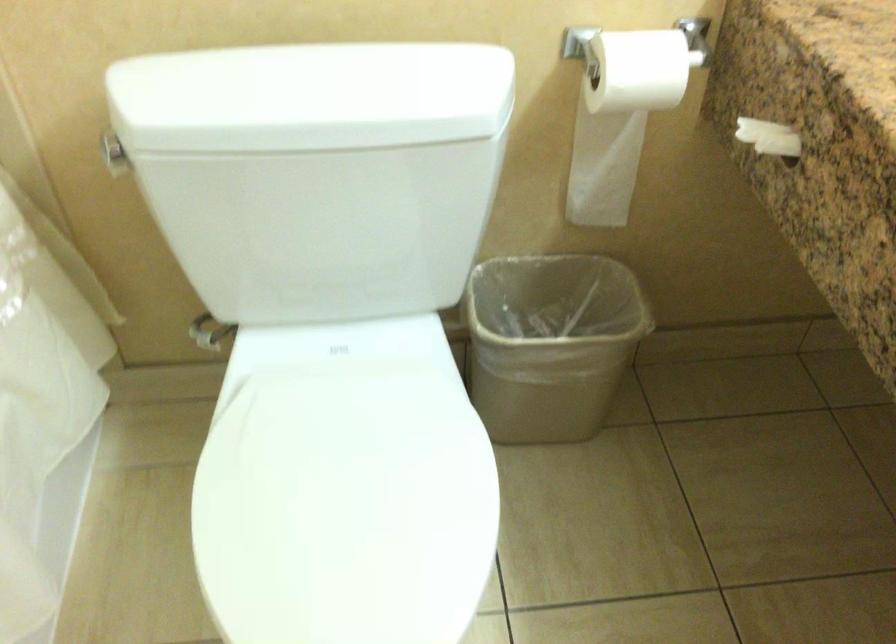
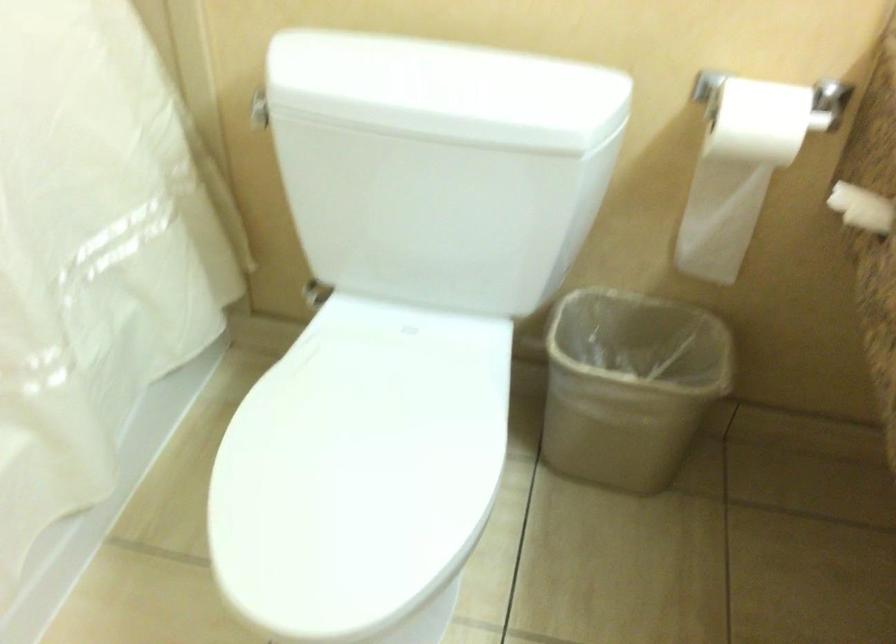
Where in the second image is the point corresponding to the point at 562,348 from the first image?

(629, 384)